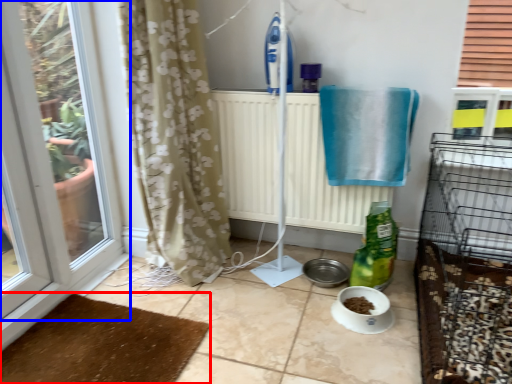
Question: Which point is closer to the camera, doormat (highlighted by a red box) or window (highlighted by a blue box)?

Choices:
 (A) doormat
 (B) window

Answer: (B)